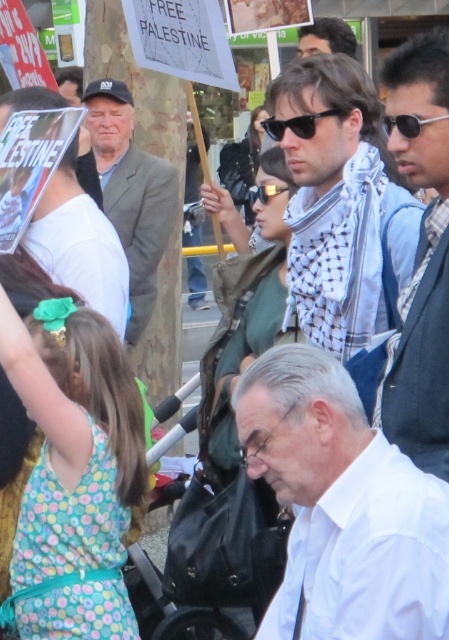
Can you confirm if dark gray fabric vest at upper right is wider than black plastic sunglasses at upper center?

Correct, the width of dark gray fabric vest at upper right exceeds that of black plastic sunglasses at upper center.

Does dark gray fabric vest at upper right appear on the right side of black plastic sunglasses at upper center?

Correct, you'll find dark gray fabric vest at upper right to the right of black plastic sunglasses at upper center.

Is point (410, 284) more distant than point (413, 129)?

Yes, point (410, 284) is farther from viewer.

At what (x,y) coordinates should I click in order to perform the action: click on dark gray fabric vest at upper right. Please return your answer as a coordinate pair (x, y). The width and height of the screenshot is (449, 640). Looking at the image, I should click on (421, 257).

Does dark gray fabric vest at upper right come in front of gray woolen suit at center?

Yes, it is in front of gray woolen suit at center.

Does dark gray fabric vest at upper right appear under gray woolen suit at center?

Indeed, dark gray fabric vest at upper right is positioned under gray woolen suit at center.

Between point (410, 433) and point (97, 150), which one is positioned behind?

The point (97, 150) is behind.

Identify the location of dark gray fabric vest at upper right. (421, 257).

Who is lower down, light blue shirt at upper center or black plastic goggles at center?

black plastic goggles at center is lower down.

Is light blue shirt at upper center above black plastic goggles at center?

Correct, light blue shirt at upper center is located above black plastic goggles at center.

You are a GUI agent. You are given a task and a screenshot of the screen. Output one action in this format:
    pyautogui.click(x=<x>, y=<y>)
    Task: Click on the light blue shirt at upper center
    Image resolution: width=449 pixels, height=640 pixels.
    Given the screenshot: What is the action you would take?
    pyautogui.click(x=325, y=36)